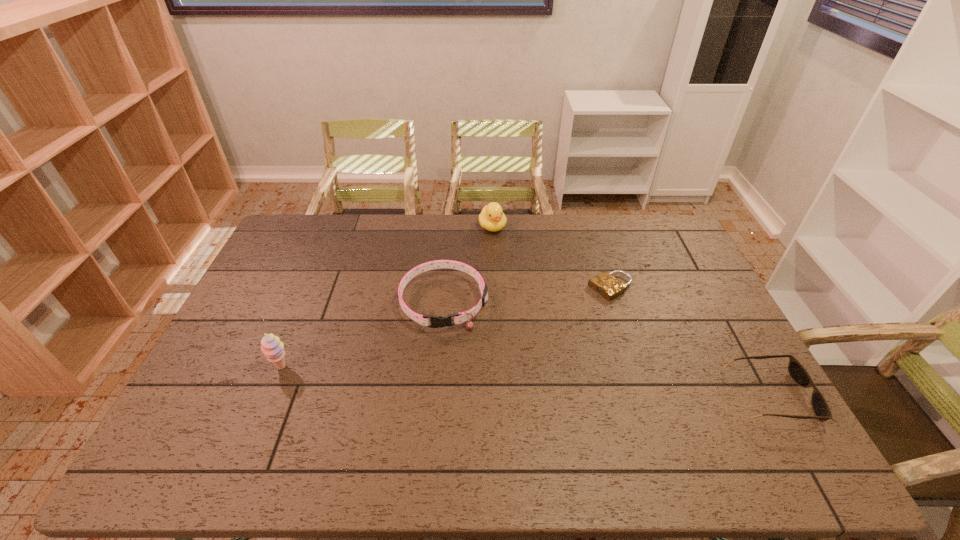
Find the location of a particular element. The height and width of the screenshot is (540, 960). the tallest object is located at coordinates (273, 349).

You are a GUI agent. You are given a task and a screenshot of the screen. Output one action in this format:
    pyautogui.click(x=<x>, y=<y>)
    Task: Click on the sherbert
    This screenshot has height=540, width=960.
    Given the screenshot: What is the action you would take?
    pyautogui.click(x=273, y=349)

This screenshot has height=540, width=960. What are the coordinates of `the rightmost object` in the screenshot? It's located at (798, 373).

At what (x,y) coordinates should I click in order to perform the action: click on sunglasses. Please return your answer as a coordinate pair (x, y). The height and width of the screenshot is (540, 960). Looking at the image, I should click on (798, 373).

Where is `the shortest object`? This screenshot has height=540, width=960. the shortest object is located at coordinates (605, 284).

Locate an element on the screen. padlock is located at coordinates (605, 284).

Where is `the third tallest object`? The image size is (960, 540). the third tallest object is located at coordinates (436, 321).

The height and width of the screenshot is (540, 960). Identify the location of the fourth shortest object. (492, 218).

Where is `the farthest object`? Image resolution: width=960 pixels, height=540 pixels. the farthest object is located at coordinates (492, 218).

This screenshot has height=540, width=960. Identify the location of free location located 0.250m on the right of the leftmost object. tap(382, 368).